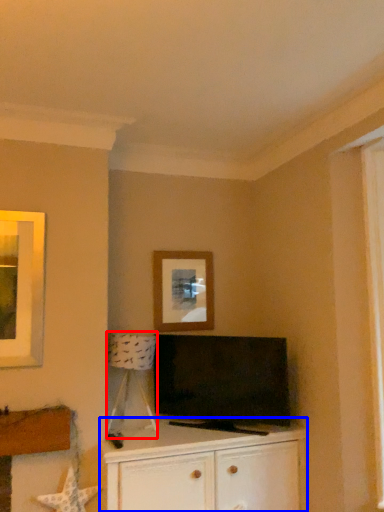
Question: Which object appears farthest to the camera in this image, lamp (highlighted by a red box) or cabinetry (highlighted by a blue box)?

Choices:
 (A) lamp
 (B) cabinetry

Answer: (A)